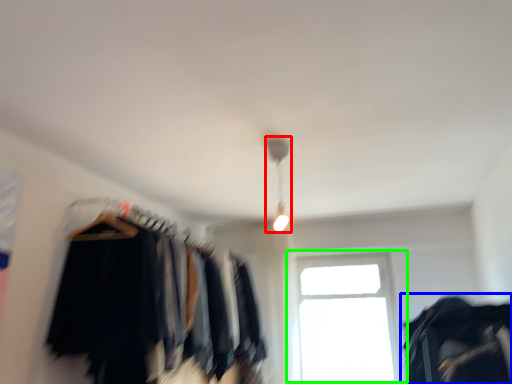
Question: Estimate the real-world distances between objects in this image. Which object is farther from lamp (highlighted by a red box), clothing (highlighted by a blue box) or window (highlighted by a green box)?

Choices:
 (A) clothing
 (B) window

Answer: (B)